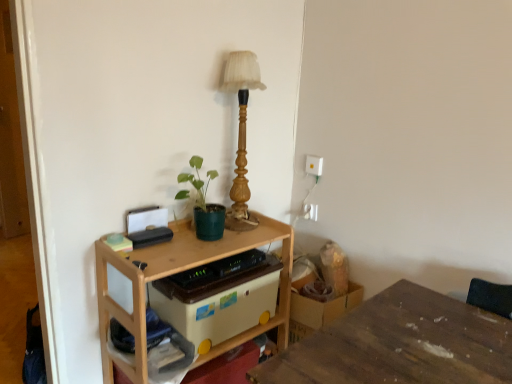
Question: Visually, is wooden table lamp at upper center positioned to the left or to the right of white plastic electric outlet at upper right, the first electric outlet ordered from the bottom?

Choices:
 (A) right
 (B) left

Answer: (B)

Question: From the image's perspective, is wooden table lamp at upper center positioned above or below white plastic electric outlet at upper right, the 2th electric outlet from the top?

Choices:
 (A) above
 (B) below

Answer: (A)

Question: Based on their relative distances, which object is farther from the wooden table at center, the first table positioned from the left?

Choices:
 (A) wooden table lamp at upper center
 (B) beige plastic storage box at center
 (C) wooden table at lower right, the 2th table viewed from the left
 (D) white plastic electric outlet at upper right, the 2th electric outlet from the top
 (E) green matte plant at center

Answer: (D)

Question: Which of these objects is positioned closest to the white plastic electric outlet at upper right, which ranks as the 1th electric outlet in top-to-bottom order?

Choices:
 (A) green matte plant at center
 (B) wooden table at lower right, positioned as the first table in right-to-left order
 (C) white plastic electric outlet at upper right, the first electric outlet ordered from the bottom
 (D) wooden table at center, arranged as the 2th table when viewed from the right
 (E) beige plastic storage box at center

Answer: (C)